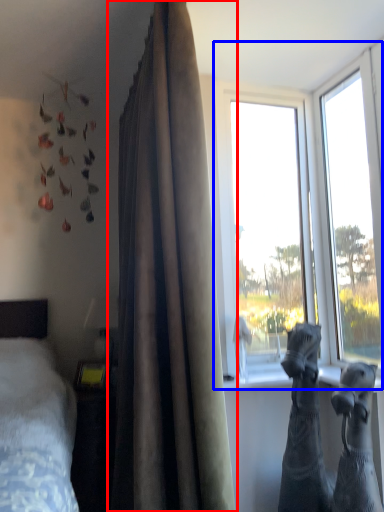
Question: Among these objects, which one is farthest to the camera, curtain (highlighted by a red box) or window (highlighted by a blue box)?

Choices:
 (A) curtain
 (B) window

Answer: (B)